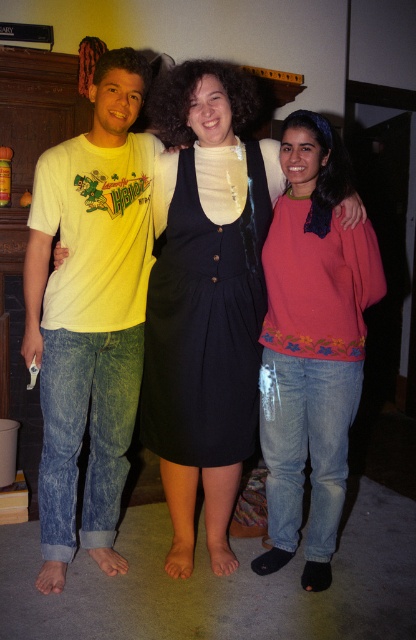
Question: Which of the following is the closest to the observer?

Choices:
 (A) (307, 232)
 (B) (119, 333)
 (C) (262, 140)

Answer: (A)

Question: Which of the following is the farthest from the observer?

Choices:
 (A) matte black dress at center
 (B) yellow cotton t-shirt at left
 (C) pink fleece sweater at center

Answer: (C)

Question: Among these objects, which one is farthest from the camera?

Choices:
 (A) pink fleece sweater at center
 (B) yellow cotton t-shirt at left

Answer: (A)

Question: Can you confirm if yellow cotton t-shirt at left is thinner than matte black dress at center?

Choices:
 (A) no
 (B) yes

Answer: (B)

Question: Does pink fleece sweater at center appear under matte black dress at center?

Choices:
 (A) no
 (B) yes

Answer: (B)

Question: Is pink fleece sweater at center below matte black dress at center?

Choices:
 (A) yes
 (B) no

Answer: (A)